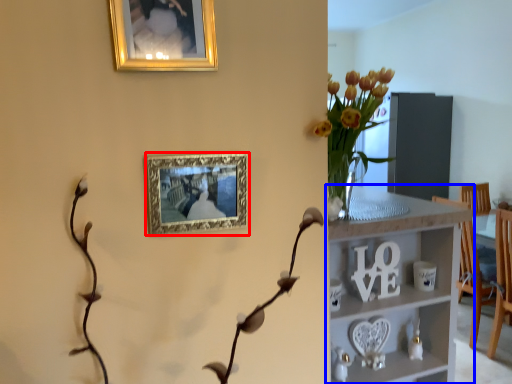
Question: Which object is further to the camera taking this photo, picture frame (highlighted by a red box) or shelf (highlighted by a blue box)?

Choices:
 (A) picture frame
 (B) shelf

Answer: (B)